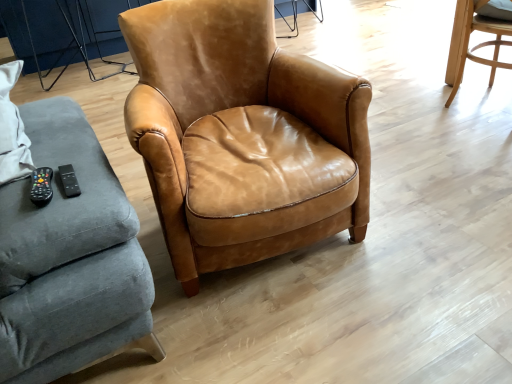
Locate an element on the screen. This screenshot has width=512, height=384. free point to the left of light brown leather chair at upper right, which appears as the 1th chair when viewed from the right is located at coordinates (416, 119).